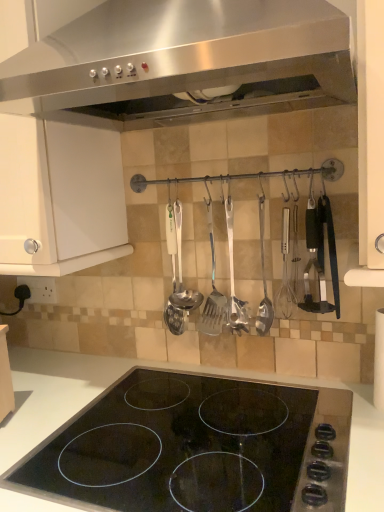
I want to click on vacant location below white matte cabinet at upper left (from a real-world perspective), so click(x=66, y=381).